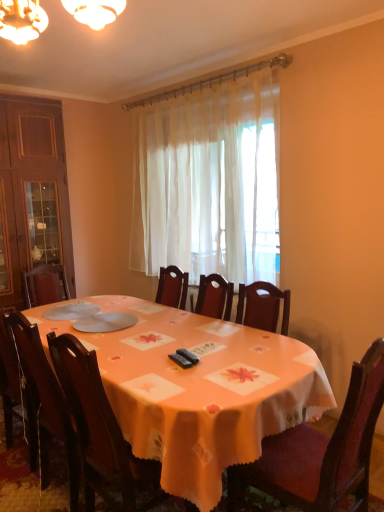
Question: Which direction should I rotate to look at wooden chair at center, the second chair when ordered from right to left?

Choices:
 (A) right
 (B) left

Answer: (B)

Question: Is there a large distance between white matte plates at center and wooden chair at center, acting as the 2th chair starting from the left?

Choices:
 (A) yes
 (B) no

Answer: (A)

Question: From a real-world perspective, is white matte plates at center located higher than wooden chair at center, the second chair when ordered from right to left?

Choices:
 (A) yes
 (B) no

Answer: (A)

Question: Considering the relative sizes of white matte plates at center and wooden chair at center, the second chair when ordered from right to left, in the image provided, is white matte plates at center shorter than wooden chair at center, the second chair when ordered from right to left,?

Choices:
 (A) yes
 (B) no

Answer: (A)

Question: Is the depth of white matte plates at center less than that of wooden chair at center, the second chair when ordered from right to left?

Choices:
 (A) no
 (B) yes

Answer: (A)

Question: Considering the relative sizes of white matte plates at center and wooden chair at center, acting as the 2th chair starting from the left, in the image provided, is white matte plates at center thinner than wooden chair at center, acting as the 2th chair starting from the left,?

Choices:
 (A) yes
 (B) no

Answer: (A)

Question: Can you confirm if white matte plates at center is positioned to the left of wooden chair at center, acting as the 2th chair starting from the left?

Choices:
 (A) no
 (B) yes

Answer: (B)

Question: Considering the relative sizes of wooden chair at center, the second chair when ordered from right to left, and orange fabric table at center in the image provided, is wooden chair at center, the second chair when ordered from right to left, shorter than orange fabric table at center?

Choices:
 (A) yes
 (B) no

Answer: (B)

Question: Is wooden chair at center, the second chair when ordered from right to left, to the right of orange fabric table at center from the viewer's perspective?

Choices:
 (A) yes
 (B) no

Answer: (A)

Question: Is wooden chair at center, acting as the 2th chair starting from the left, oriented towards orange fabric table at center?

Choices:
 (A) yes
 (B) no

Answer: (A)

Question: Is wooden chair at center, the second chair when ordered from right to left, looking in the opposite direction of orange fabric table at center?

Choices:
 (A) no
 (B) yes

Answer: (B)

Question: From the image's perspective, would you say wooden chair at center, acting as the 2th chair starting from the left, is shown under orange fabric table at center?

Choices:
 (A) yes
 (B) no

Answer: (B)

Question: Is wooden chair at center, the second chair when ordered from right to left, placed right next to orange fabric table at center?

Choices:
 (A) no
 (B) yes

Answer: (A)

Question: Can you confirm if orange fabric table at center is shorter than wooden chair at center, the second chair when ordered from right to left?

Choices:
 (A) yes
 (B) no

Answer: (A)